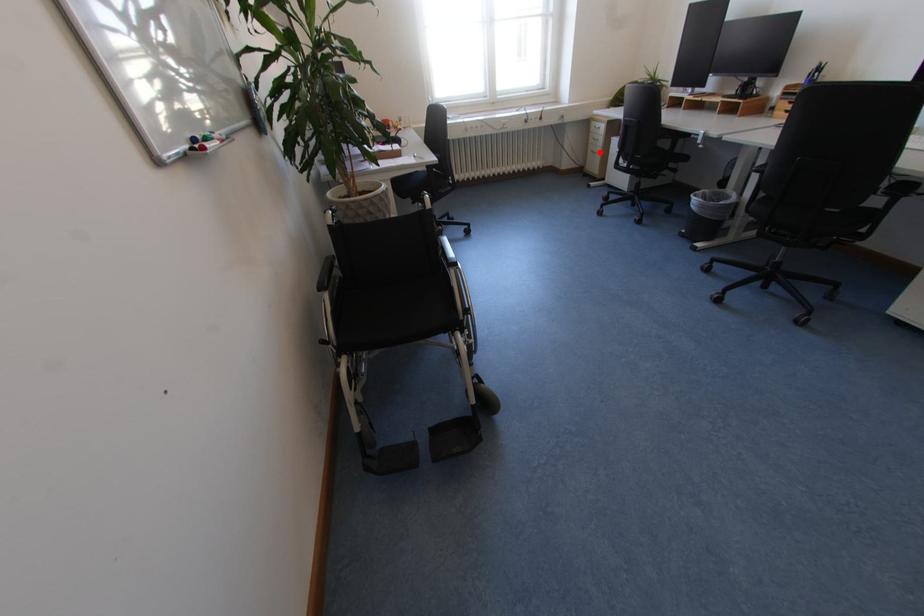
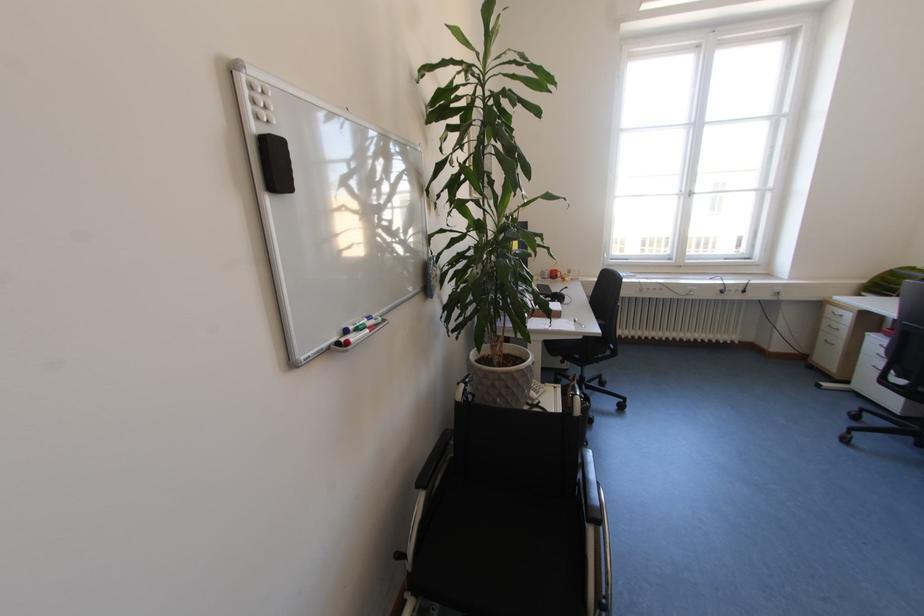
Question: I am providing you with two images of the same scene from different viewpoints. A red point is marked on the first image. Is the red point's position out of view in image 2?

Choices:
 (A) Yes
 (B) No

Answer: (B)